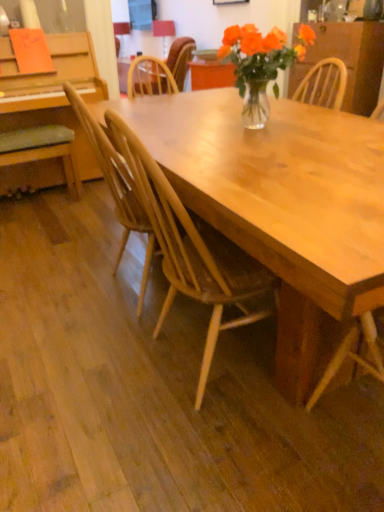
Find the location of `wooden dresser at upper right`. wooden dresser at upper right is located at coordinates (348, 60).

What is the approximate width of wooden dresser at upper right?

wooden dresser at upper right is 47.67 centimeters in width.

What do you see at coordinates (42, 150) in the screenshot? I see `green fabric cushion at left, positioned as the second chair in back-to-front order` at bounding box center [42, 150].

What do you see at coordinates (162, 70) in the screenshot? I see `wooden chair at center, which ranks as the 1th chair in back-to-front order` at bounding box center [162, 70].

Where is `wooden dresser at upper right`? The image size is (384, 512). wooden dresser at upper right is located at coordinates (348, 60).

Is green fabric cushion at left, the 2th chair in the top-to-bottom sequence, looking in the opposite direction of wooden chair at center, the first chair when ordered from top to bottom?

No, green fabric cushion at left, the 2th chair in the top-to-bottom sequence, is not facing away from wooden chair at center, the first chair when ordered from top to bottom.

Can you tell me how much green fabric cushion at left, which appears as the 3th chair when viewed from the front, and wooden chair at center, which ranks as the 1th chair in back-to-front order, differ in facing direction?

The facing directions of green fabric cushion at left, which appears as the 3th chair when viewed from the front, and wooden chair at center, which ranks as the 1th chair in back-to-front order, are 91.2 degrees apart.

This screenshot has height=512, width=384. Find the location of `chair that is the 1st object located in front of the wooden chair at center, which ranks as the 1th chair in back-to-front order`. chair that is the 1st object located in front of the wooden chair at center, which ranks as the 1th chair in back-to-front order is located at coordinates click(x=42, y=150).

Measure the distance from green fabric cushion at left, which is the 3th chair in bottom-to-top order, to wooden chair at center, which is the fourth chair in bottom-to-top order.

green fabric cushion at left, which is the 3th chair in bottom-to-top order, is 34.32 inches away from wooden chair at center, which is the fourth chair in bottom-to-top order.

Is light brown wood chair at center, the 2th chair positioned from the bottom, in contact with wooden dresser at upper right?

No, light brown wood chair at center, the 2th chair positioned from the bottom, is not touching wooden dresser at upper right.

Does light brown wood chair at center, which is the 3th chair from back to front, have a smaller size compared to wooden dresser at upper right?

Correct, light brown wood chair at center, which is the 3th chair from back to front, occupies less space than wooden dresser at upper right.

Is wooden dresser at upper right a part of light brown wood chair at center, which is the 3th chair from back to front?

That's incorrect, wooden dresser at upper right is not inside light brown wood chair at center, which is the 3th chair from back to front.

Is light brown wood chair at center, marked as the 2th chair in a front-to-back arrangement, positioned with its back to wooden dresser at upper right?

light brown wood chair at center, marked as the 2th chair in a front-to-back arrangement, is not turned away from wooden dresser at upper right.

Would you say wooden dresser at upper right is part of wooden chair at center, which is the fourth chair in bottom-to-top order,'s contents?

No, wooden dresser at upper right is not a part of wooden chair at center, which is the fourth chair in bottom-to-top order.

Is wooden chair at center, which appears as the 4th chair when viewed from the front, aimed at wooden dresser at upper right?

No.

Measure the distance between wooden chair at center, which ranks as the 1th chair in back-to-front order, and wooden dresser at upper right.

wooden chair at center, which ranks as the 1th chair in back-to-front order, is 1.35 meters away from wooden dresser at upper right.

Between point (133, 79) and point (362, 56), which one is positioned behind?

The point (362, 56) is behind.

From a real-world perspective, is translucent glass vase at center positioned under wooden dresser at upper right based on gravity?

No, from a real-world perspective, translucent glass vase at center is not under wooden dresser at upper right.

Which of these two, translucent glass vase at center or wooden dresser at upper right, is wider?

wooden dresser at upper right.

Is translucent glass vase at center aimed at wooden dresser at upper right?

No, translucent glass vase at center is not facing towards wooden dresser at upper right.

Which point is more distant from viewer, (240, 91) or (368, 95)?

The point (368, 95) is farther.

From a real-world perspective, who is located higher, wooden chair at center, placed as the first chair when sorted from bottom to top, or wooden chair at center, which is the fourth chair in bottom-to-top order?

In real-world perspective, wooden chair at center, which is the fourth chair in bottom-to-top order, is above.

Which object is more forward, wooden chair at center, arranged as the fourth chair when viewed from the top, or wooden chair at center, the first chair when ordered from top to bottom?

wooden chair at center, arranged as the fourth chair when viewed from the top, is more forward.

From the wooden chair at center, arranged as the fourth chair when viewed from the top, count the 2nd chair to the left and point to it. Please provide its 2D coordinates.

[(162, 70)]

Would you say wooden chair at center, positioned as the fourth chair in back-to-front order, is part of light brown wood chair at center, the 2th chair positioned from the bottom,'s contents?

No, light brown wood chair at center, the 2th chair positioned from the bottom, does not contain wooden chair at center, positioned as the fourth chair in back-to-front order.

Who is shorter, light brown wood chair at center, the 2th chair positioned from the bottom, or wooden chair at center, positioned as the fourth chair in back-to-front order?

light brown wood chair at center, the 2th chair positioned from the bottom, is shorter.

Is light brown wood chair at center, the 3th chair positioned from the top, closer to the viewer compared to wooden chair at center, placed as the first chair when sorted from bottom to top?

No, it is not.

Does light brown wood chair at center, which is the 3th chair from back to front, have a larger size compared to wooden chair at center, placed as the first chair when sorted from bottom to top?

No.

I want to click on dresser on the right side of green fabric cushion at left, positioned as the second chair in back-to-front order, so click(348, 60).

Based on their positions, is wooden dresser at upper right located to the left or right of green fabric cushion at left, which is the 3th chair in bottom-to-top order?

wooden dresser at upper right is positioned on green fabric cushion at left, which is the 3th chair in bottom-to-top order,'s right side.

Is the depth of wooden dresser at upper right greater than that of green fabric cushion at left, which is the 3th chair in bottom-to-top order?

Yes, the depth of wooden dresser at upper right is greater than that of green fabric cushion at left, which is the 3th chair in bottom-to-top order.

Find the location of a particular element. chair that appears behind the green fabric cushion at left, positioned as the second chair in back-to-front order is located at coordinates (162, 70).

Starting from the wooden dresser at upper right, which chair is the 2nd one to the left? Please provide its 2D coordinates.

[(117, 186)]

Considering their positions, is light brown wood chair at center, the 3th chair positioned from the top, positioned closer to wooden chair at center, which ranks as the 1th chair in back-to-front order, than translucent glass vase at center?

Among the two, translucent glass vase at center is located nearer to wooden chair at center, which ranks as the 1th chair in back-to-front order.

When comparing their distances from translucent glass vase at center, does wooden chair at center, arranged as the fourth chair when viewed from the top, or wooden dresser at upper right seem further?

The object further to translucent glass vase at center is wooden dresser at upper right.

Which object lies nearer to the anchor point green fabric cushion at left, which appears as the 3th chair when viewed from the front, wooden chair at center, which is the 1th chair from front to back, or light brown wood chair at center, the 2th chair positioned from the bottom?

Based on the image, light brown wood chair at center, the 2th chair positioned from the bottom, appears to be nearer to green fabric cushion at left, which appears as the 3th chair when viewed from the front.

Based on their spatial positions, is green fabric cushion at left, which appears as the 3th chair when viewed from the front, or translucent glass vase at center further from light brown wood chair at center, the 2th chair positioned from the bottom?

green fabric cushion at left, which appears as the 3th chair when viewed from the front, lies further to light brown wood chair at center, the 2th chair positioned from the bottom, than the other object.

Based on their spatial positions, is green fabric cushion at left, the 2th chair in the top-to-bottom sequence, or translucent glass vase at center closer to wooden chair at center, placed as the first chair when sorted from bottom to top?

The object closer to wooden chair at center, placed as the first chair when sorted from bottom to top, is translucent glass vase at center.

From the picture: Considering their positions, is wooden dresser at upper right positioned further to wooden chair at center, the first chair when ordered from top to bottom, than wooden chair at center, placed as the first chair when sorted from bottom to top?

Among the two, wooden chair at center, placed as the first chair when sorted from bottom to top, is located further to wooden chair at center, the first chair when ordered from top to bottom.

Looking at the image, which one is located further to wooden dresser at upper right, translucent glass vase at center or wooden chair at center, placed as the first chair when sorted from bottom to top?

wooden chair at center, placed as the first chair when sorted from bottom to top, is positioned further to the anchor wooden dresser at upper right.

Based on their spatial positions, is translucent glass vase at center or wooden chair at center, positioned as the fourth chair in back-to-front order, further from green fabric cushion at left, which is the 3th chair in bottom-to-top order?

wooden chair at center, positioned as the fourth chair in back-to-front order.

This screenshot has width=384, height=512. In order to click on chair positioned between light brown wood chair at center, the 3th chair positioned from the top, and wooden chair at center, which ranks as the 1th chair in back-to-front order, from near to far in this screenshot , I will do (42, 150).

The height and width of the screenshot is (512, 384). Find the location of `dresser between light brown wood chair at center, marked as the 2th chair in a front-to-back arrangement, and wooden chair at center, which is the fourth chair in bottom-to-top order, in the front-back direction`. dresser between light brown wood chair at center, marked as the 2th chair in a front-to-back arrangement, and wooden chair at center, which is the fourth chair in bottom-to-top order, in the front-back direction is located at coordinates (348, 60).

Locate an element on the screen. Image resolution: width=384 pixels, height=512 pixels. dresser positioned between wooden chair at center, arranged as the fourth chair when viewed from the top, and wooden chair at center, which appears as the 4th chair when viewed from the front, from near to far is located at coordinates (348, 60).

The height and width of the screenshot is (512, 384). What are the coordinates of `houseplant positioned between wooden chair at center, placed as the first chair when sorted from bottom to top, and green fabric cushion at left, the 2th chair in the top-to-bottom sequence, from near to far` in the screenshot? It's located at (260, 64).